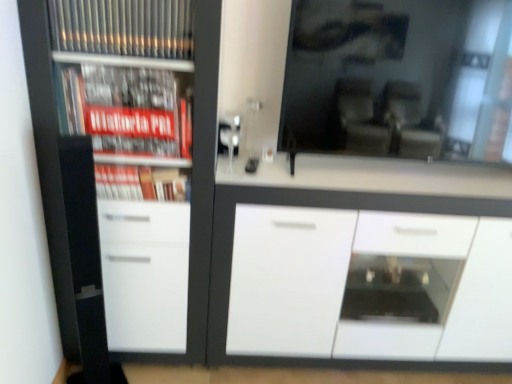
Question: Based on their positions, is transparent glass mirror at upper center located to the left or right of white glossy cabinet at center?

Choices:
 (A) left
 (B) right

Answer: (B)

Question: Considering their positions, is transparent glass mirror at upper center located in front of or behind white glossy cabinet at center?

Choices:
 (A) behind
 (B) front

Answer: (B)

Question: Which object is positioned closest to the white glossy cabinet at center?

Choices:
 (A) white glossy cupboard at left
 (B) transparent glass mirror at upper center

Answer: (B)

Question: Which object is the closest to the transparent glass mirror at upper center?

Choices:
 (A) white glossy cabinet at center
 (B) white glossy cupboard at left

Answer: (A)